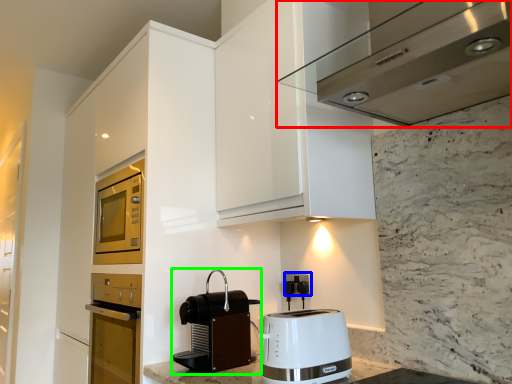
Question: Based on their relative distances, which object is nearer to home appliance (highlighted by a red box)? Choose from electric outlet (highlighted by a blue box) and kitchen appliance (highlighted by a green box).

Choices:
 (A) electric outlet
 (B) kitchen appliance

Answer: (B)